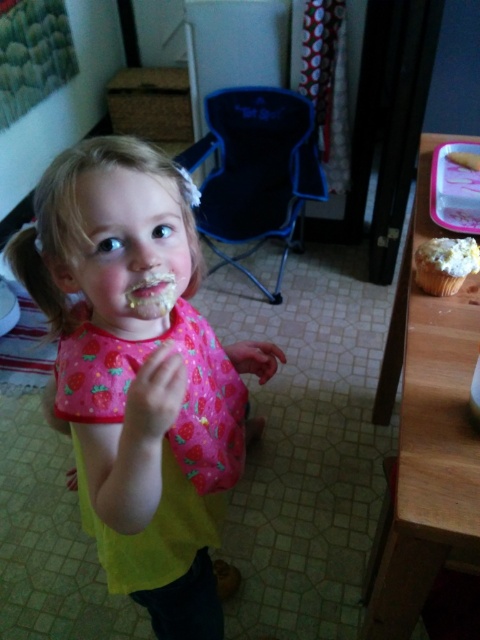
You are a parent preparing to feed your child. You have a matte pink bib at center and a white frosted cupcake at upper right. Which item is wider?

The matte pink bib at center is wider than the white frosted cupcake at upper right.

The child in the scene is wearing a matte pink bib at center and holding a white frosted cupcake at upper right. Which object is positioned to the right of the other?

The white frosted cupcake at upper right is to the right of the matte pink bib at center.